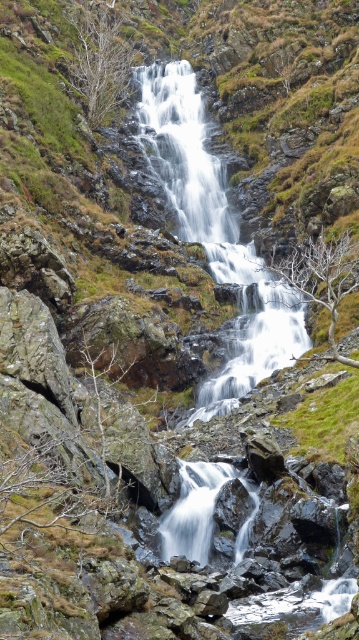
Question: Can you confirm if white frothy water at center is positioned to the right of white smooth water at center?

Choices:
 (A) no
 (B) yes

Answer: (A)

Question: Which object appears farthest from the camera in this image?

Choices:
 (A) white smooth water at center
 (B) white frothy water at center

Answer: (B)

Question: Does white frothy water at center have a greater width compared to white smooth water at center?

Choices:
 (A) yes
 (B) no

Answer: (A)

Question: Which of the following is the closest to the observer?

Choices:
 (A) white frothy water at center
 (B) white smooth water at center

Answer: (B)

Question: Does white frothy water at center have a lesser width compared to white smooth water at center?

Choices:
 (A) no
 (B) yes

Answer: (A)